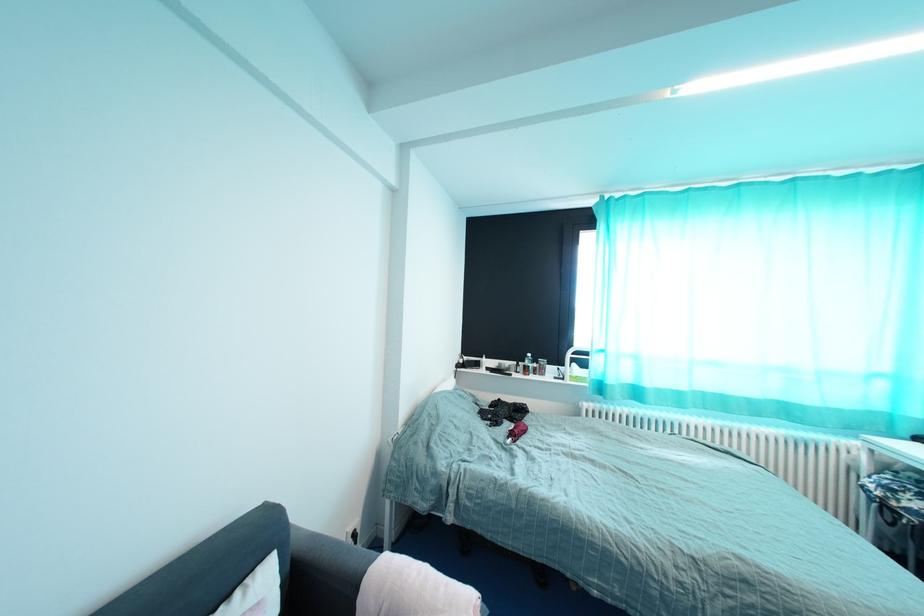
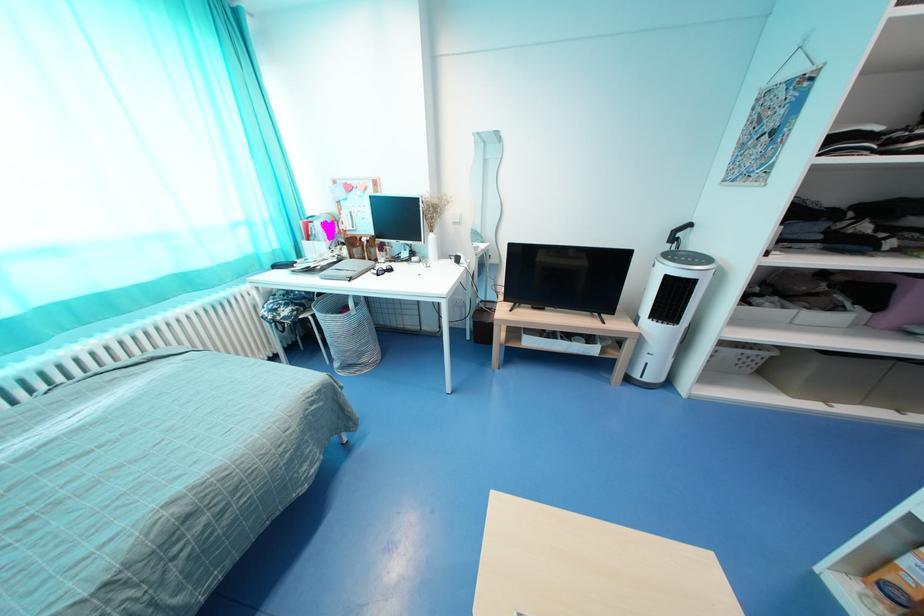
The first image is from the beginning of the video and the second image is from the end. How did the camera likely rotate when shooting the video?

The rotation direction of the camera is right-down.